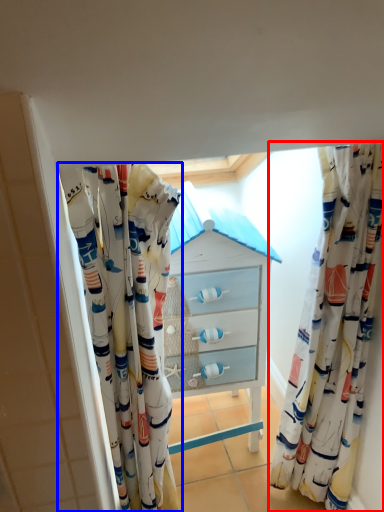
Question: Which of the following is the farthest to the observer, curtain (highlighted by a red box) or curtain (highlighted by a blue box)?

Choices:
 (A) curtain
 (B) curtain

Answer: (A)